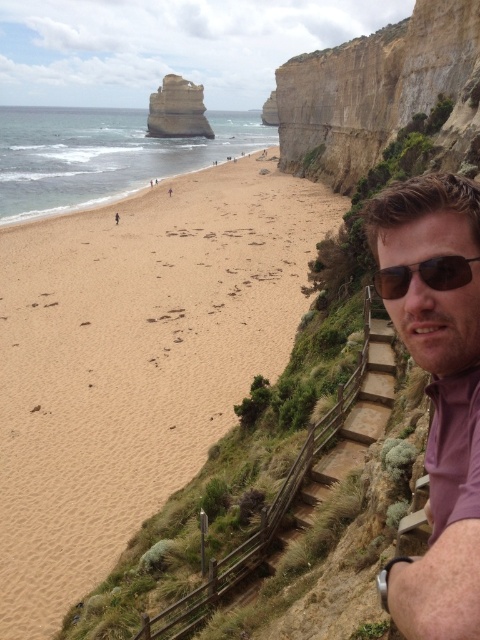
Is brown sandy beach at lower left bigger than rustic stone arch at upper center?

Indeed, brown sandy beach at lower left has a larger size compared to rustic stone arch at upper center.

Can you confirm if brown sandy beach at lower left is positioned above rustic stone arch at upper center?

Actually, brown sandy beach at lower left is below rustic stone arch at upper center.

Locate an element on the screen. brown sandy beach at lower left is located at coordinates (134, 362).

This screenshot has height=640, width=480. Find the location of `brown sandy beach at lower left`. brown sandy beach at lower left is located at coordinates (134, 362).

Between brown sand at lower left and brown matte sunglasses at right, which one is positioned higher?

brown sand at lower left is higher up.

Is brown sand at lower left shorter than brown matte sunglasses at right?

No.

Find the location of `brown sand at lower left`. brown sand at lower left is located at coordinates (100, 168).

Locate an element on the screen. The image size is (480, 640). brown sand at lower left is located at coordinates (100, 168).

Can you confirm if cliffy sandstone cliff at upper right is smaller than brown sand at lower left?

Correct, cliffy sandstone cliff at upper right occupies less space than brown sand at lower left.

Does point (288, 150) lie in front of point (155, 152)?

Yes, it is in front of point (155, 152).

Describe the element at coordinates (374, 90) in the screenshot. I see `cliffy sandstone cliff at upper right` at that location.

Where is `cliffy sandstone cliff at upper right`? This screenshot has width=480, height=640. cliffy sandstone cliff at upper right is located at coordinates (374, 90).